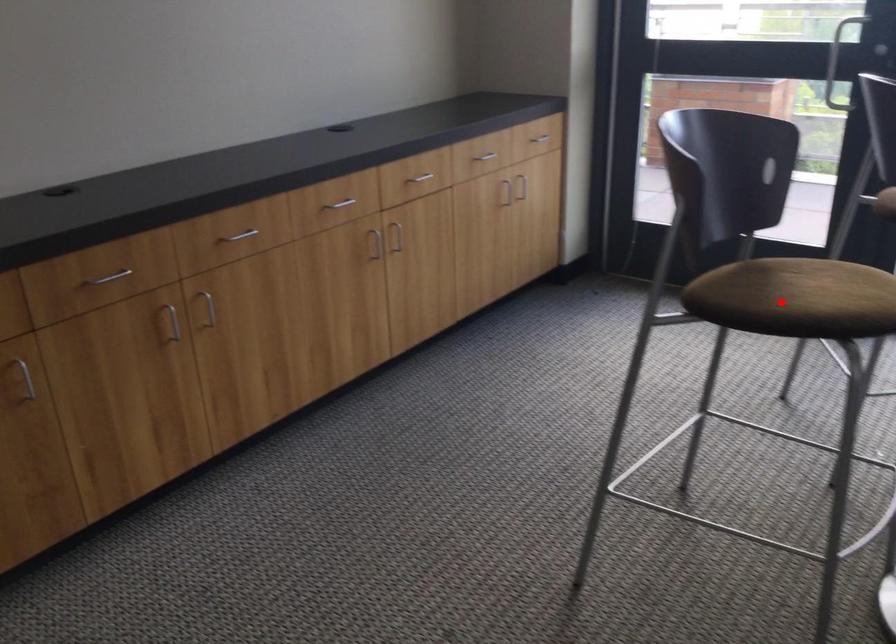
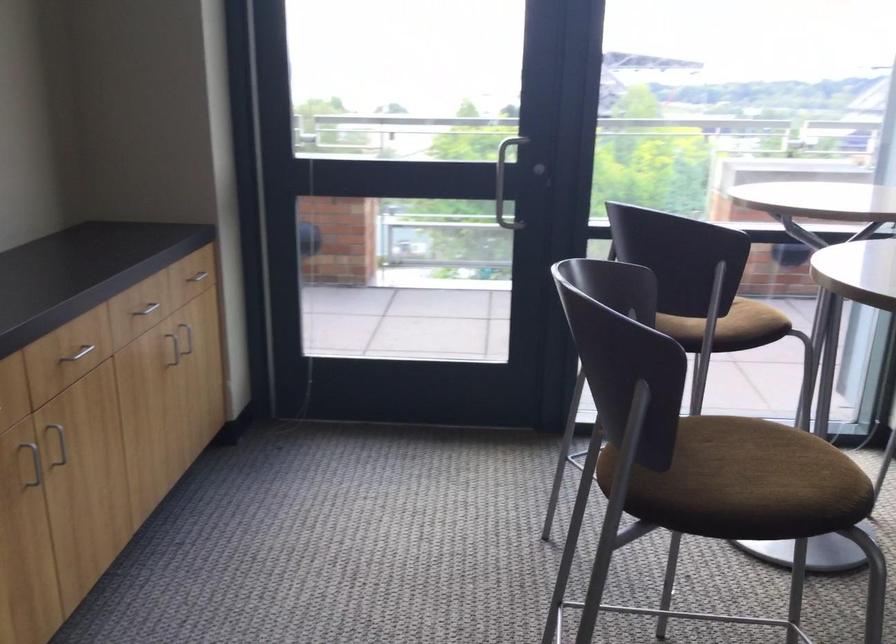
Locate, in the second image, the point that corresponds to the highlighted location in the first image.

(739, 482)